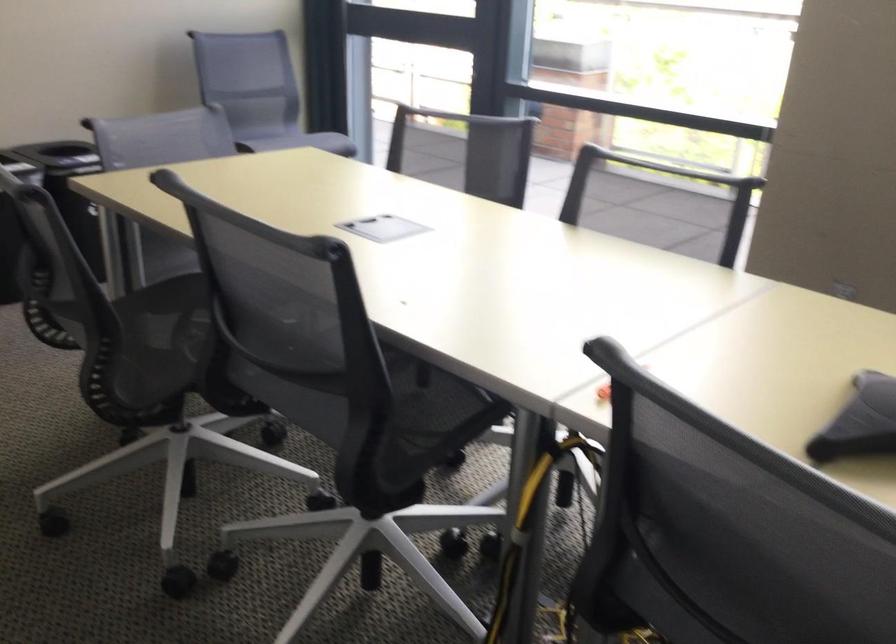
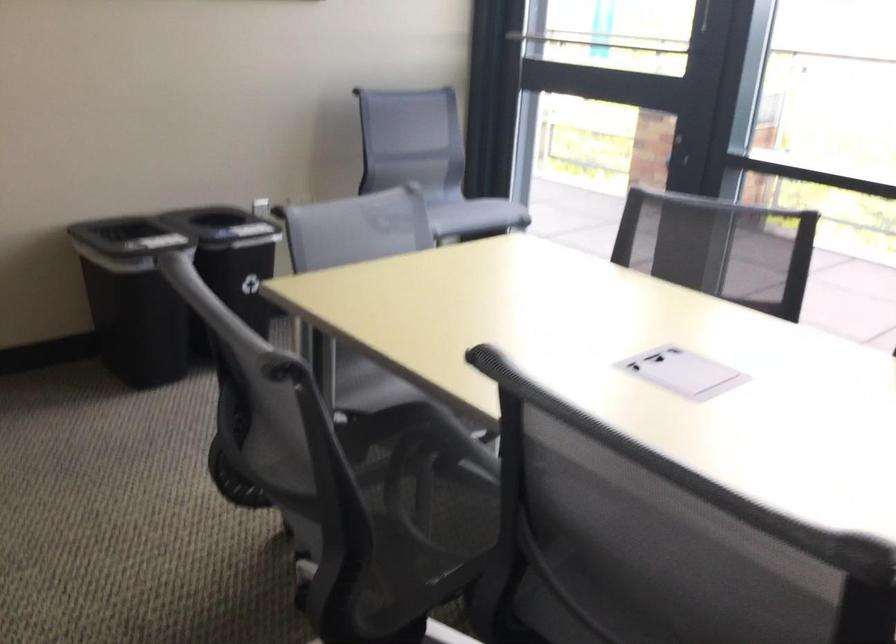
Which direction would the cameraman need to move to produce the second image?

The movement direction of the cameraman is left, forward.